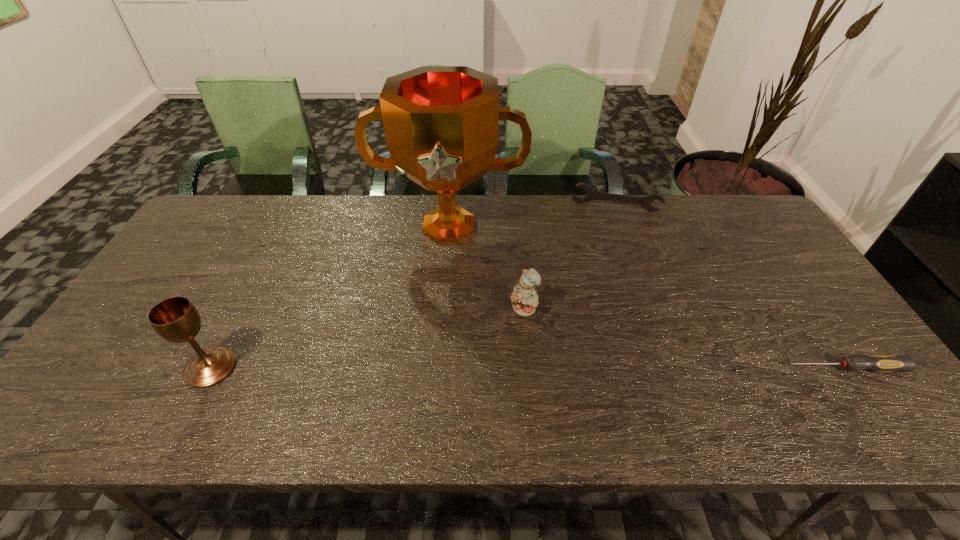
Identify the location of free space on the desktop that is between the leftmost object and the screwdriver and is positioned on the front-facing side of the third tallest object. (474, 368).

At what (x,y) coordinates should I click in order to perform the action: click on free space on the desktop that is between the leftmost object and the rightmost object and is positioned on the side of the award with the star emblem. Please return your answer as a coordinate pair (x, y). This screenshot has width=960, height=540. Looking at the image, I should click on (x=437, y=368).

Find the location of a particular element. Image resolution: width=960 pixels, height=540 pixels. vacant space on the desktop that is between the second tallest object and the shortest object and is positioned on the open ends of the second object from right to left is located at coordinates (610, 368).